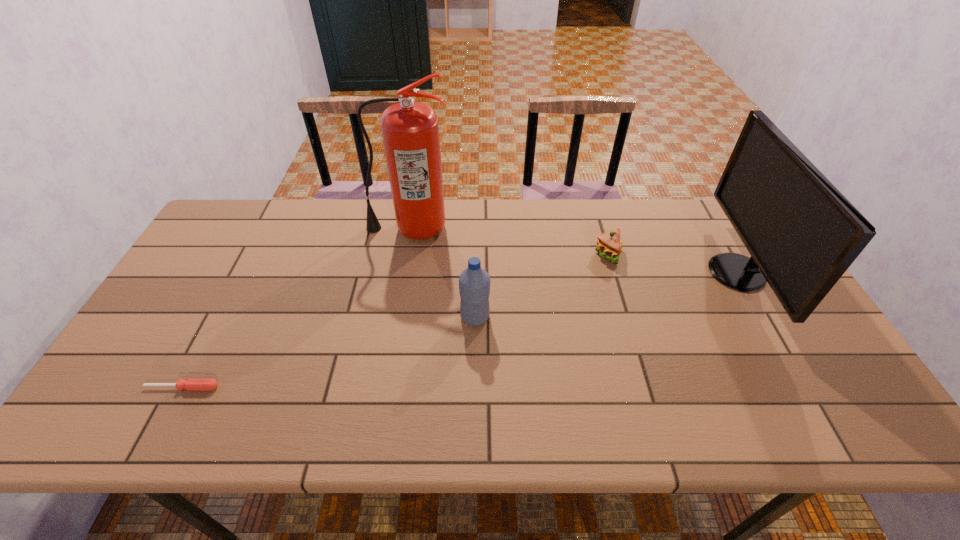
The image size is (960, 540). Find the location of `fire extinguisher`. fire extinguisher is located at coordinates (410, 131).

Identify the location of the fourth object from right to left. (410, 131).

This screenshot has width=960, height=540. Identify the location of the second tallest object. (802, 233).

Where is `computer monitor`? This screenshot has width=960, height=540. computer monitor is located at coordinates (802, 233).

Find the location of `the third tallest object`. the third tallest object is located at coordinates (474, 282).

Where is `water bottle`? water bottle is located at coordinates (474, 282).

The width and height of the screenshot is (960, 540). Find the location of `sandwich`. sandwich is located at coordinates (609, 245).

Locate an element on the screen. the fourth tallest object is located at coordinates (609, 245).

You are a GUI agent. You are given a task and a screenshot of the screen. Output one action in this format:
    pyautogui.click(x=<x>, y=<y>)
    Task: Click on the screwdriver
    Image resolution: width=960 pixels, height=540 pixels.
    Given the screenshot: What is the action you would take?
    pyautogui.click(x=191, y=384)

In order to click on the leftmost object in this screenshot , I will do `click(191, 384)`.